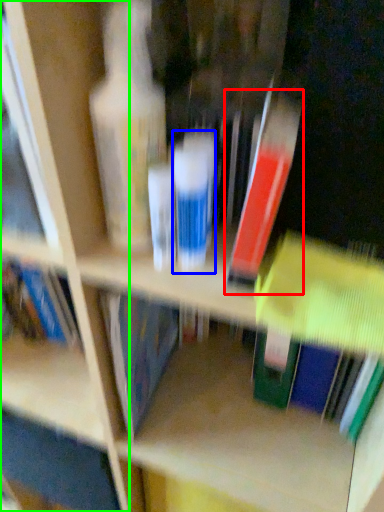
Question: Estimate the real-world distances between objects in this image. Which object is farther from book (highlighted by a red box), toiletry (highlighted by a blue box) or shelf (highlighted by a green box)?

Choices:
 (A) toiletry
 (B) shelf

Answer: (B)